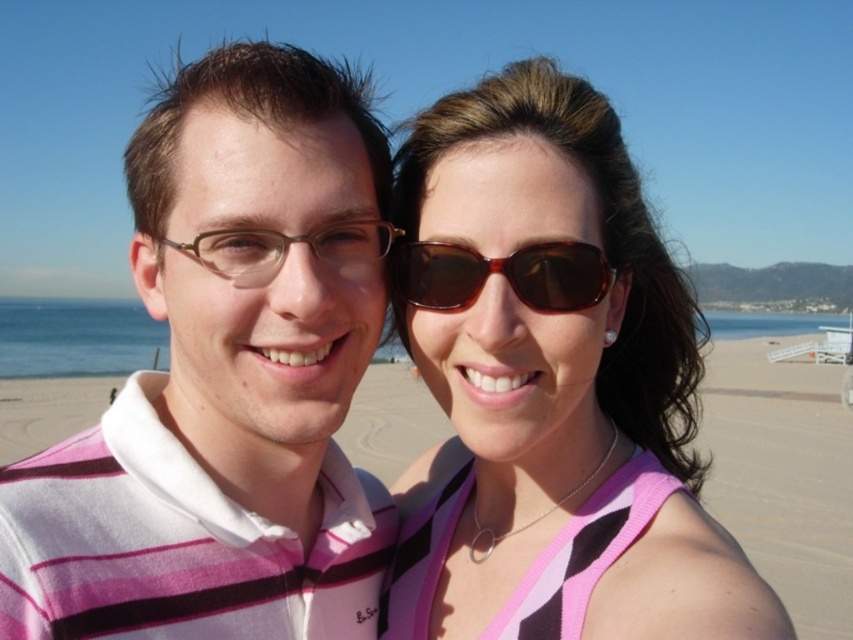
You are a photographer trying to capture the two individuals in the scene. You notice the brown tortoiseshell sunglasses at upper center and the brown matte glasses at center. Which of these two items is located to the right of the other?

The brown tortoiseshell sunglasses at upper center is positioned on the right side of brown matte glasses at center.

You are a photographer trying to capture a closeup shot of the matte brown sunglasses at upper right and the beige sand at center. Since you want to focus on the sunglasses, which object should you move closer to the camera to achieve this?

To focus on the matte brown sunglasses at upper right, you should move the beige sand at center closer to the camera since the matte brown sunglasses at upper right is much taller than the beige sand at center. By bringing the sand closer, it will appear larger in the frame, allowing both objects to be in focus while emphasizing the sunglasses.